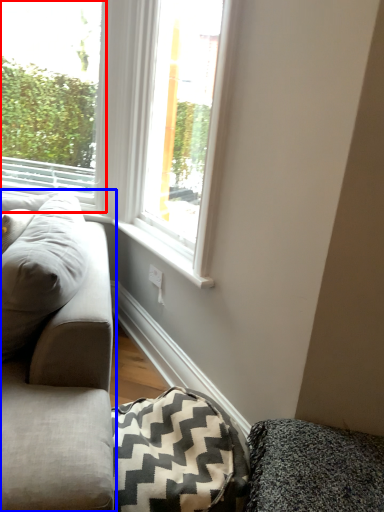
Question: Which of the following is the closest to the observer, window (highlighted by a red box) or studio couch (highlighted by a blue box)?

Choices:
 (A) window
 (B) studio couch

Answer: (B)